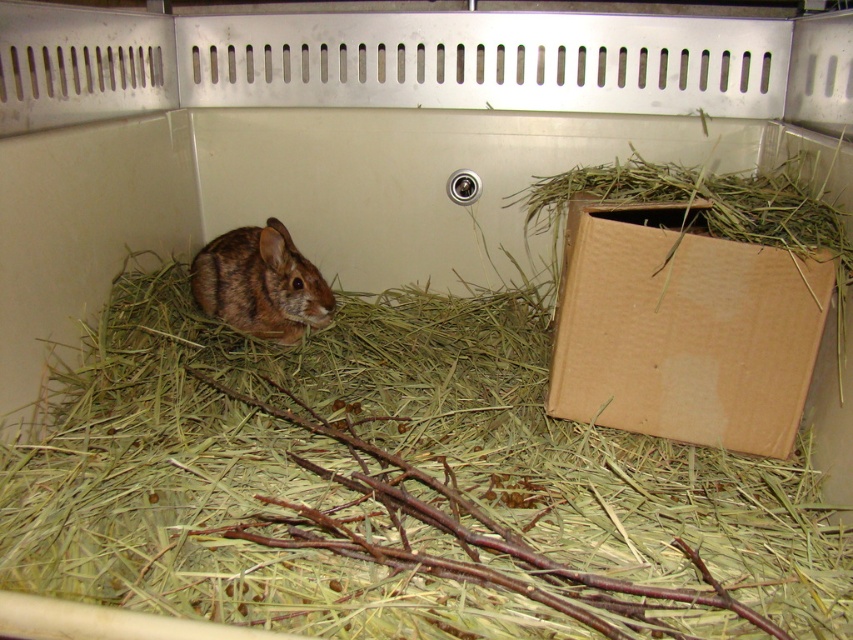
Is green straw at center thinner than brown furry rabbit at center?

No.

Is green straw at center smaller than brown furry rabbit at center?

Actually, green straw at center might be larger than brown furry rabbit at center.

I want to click on green straw at center, so click(x=395, y=484).

Identify the location of green straw at center. (395, 484).

Find the location of a particular element. brown cardboard box at right is located at coordinates (683, 326).

Can you confirm if brown cardboard box at right is bigger than brown rough twigs at center?

No.

Which is in front, point (734, 392) or point (386, 456)?

Point (386, 456) is more forward.

Identify the location of brown cardboard box at right. (683, 326).

Is brown cardboard box at right further to the viewer compared to brown furry rabbit at center?

No, brown cardboard box at right is in front of brown furry rabbit at center.

Which of these two, brown cardboard box at right or brown furry rabbit at center, stands taller?

brown cardboard box at right

Does point (741, 298) lie in front of point (201, 266)?

Yes, point (741, 298) is in front of point (201, 266).

This screenshot has height=640, width=853. I want to click on brown cardboard box at right, so click(683, 326).